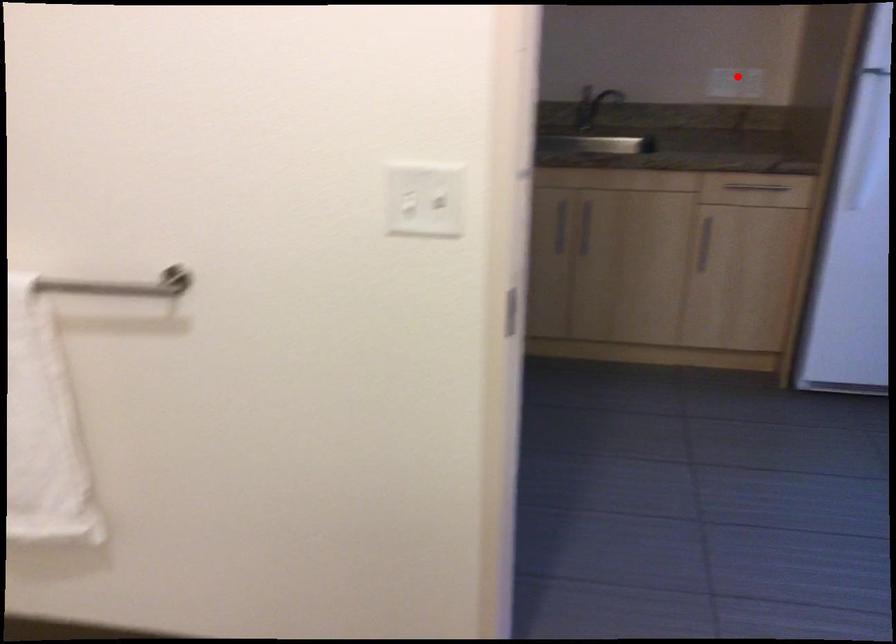
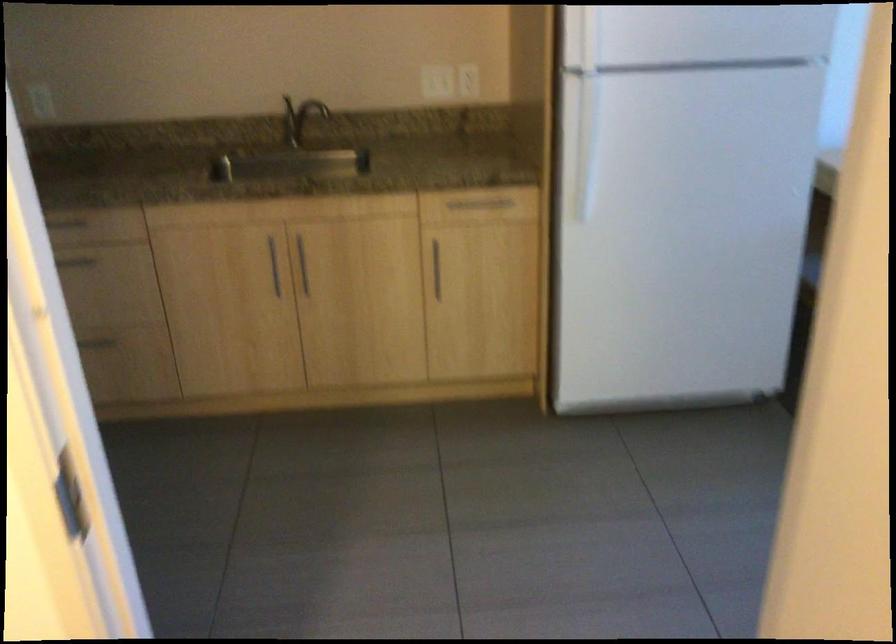
Question: I am providing you with two images of the same scene from different viewpoints. Given a red point in image1, look at the same physical point in image2. Is it:

Choices:
 (A) Closer to the viewpoint
 (B) Farther from the viewpoint

Answer: (A)